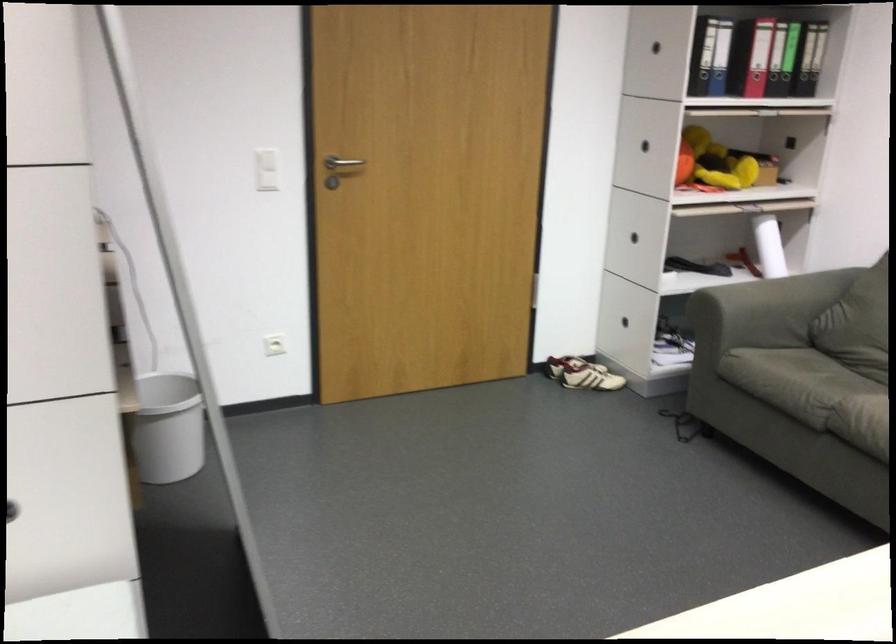
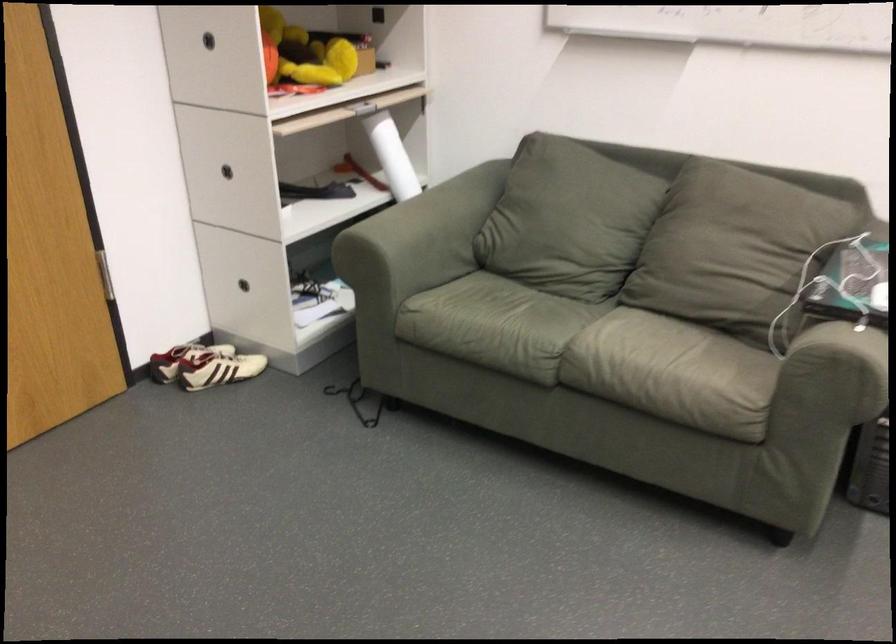
Where in the second image is the point corresponding to [752,303] from the first image?

(416, 242)